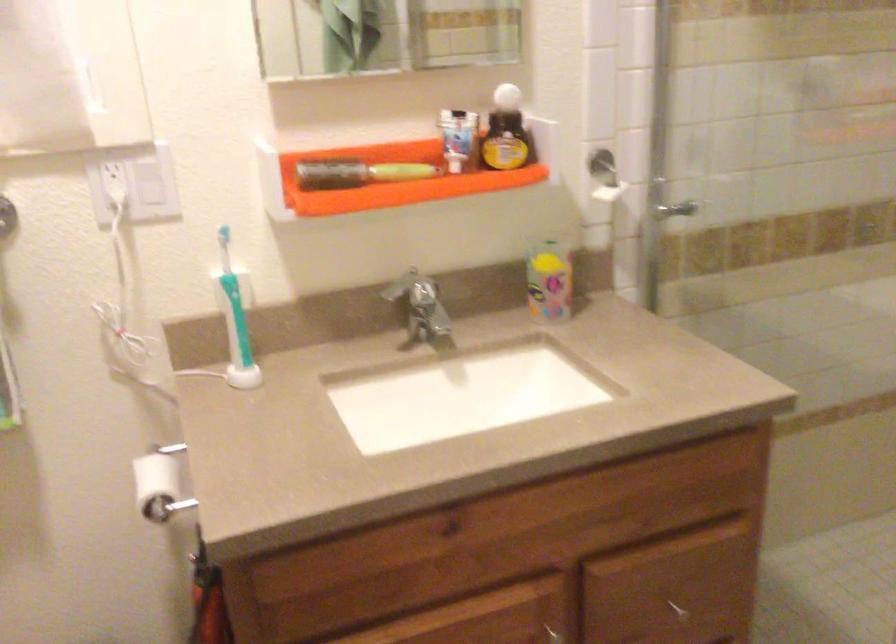
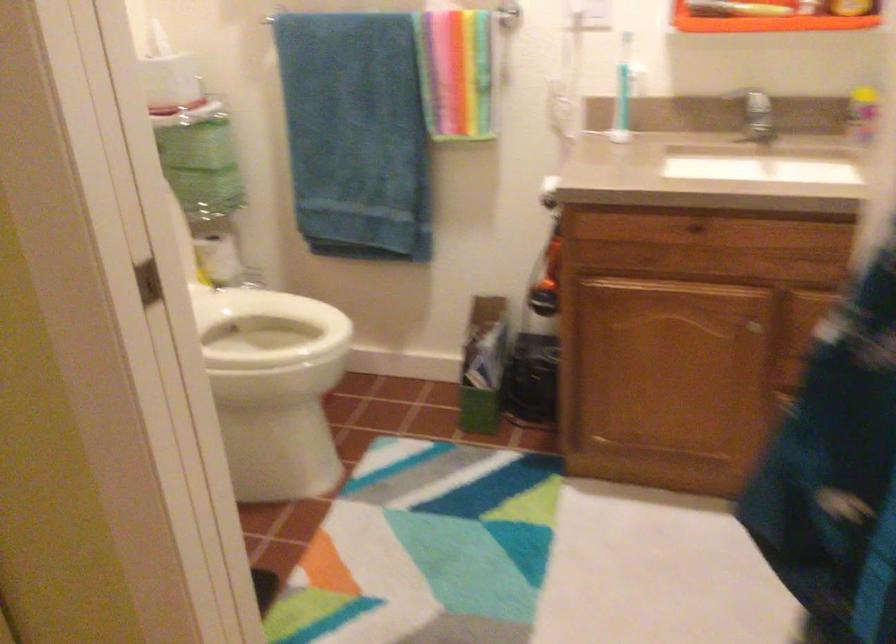
Question: The first image is from the beginning of the video and the second image is from the end. How did the camera likely rotate when shooting the video?

Choices:
 (A) Left
 (B) Right
 (C) Up
 (D) Down

Answer: (A)